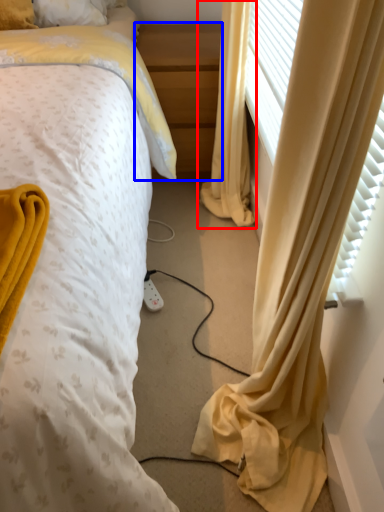
Question: Which point is closer to the camera, curtain (highlighted by a red box) or nightstand (highlighted by a blue box)?

Choices:
 (A) curtain
 (B) nightstand

Answer: (A)